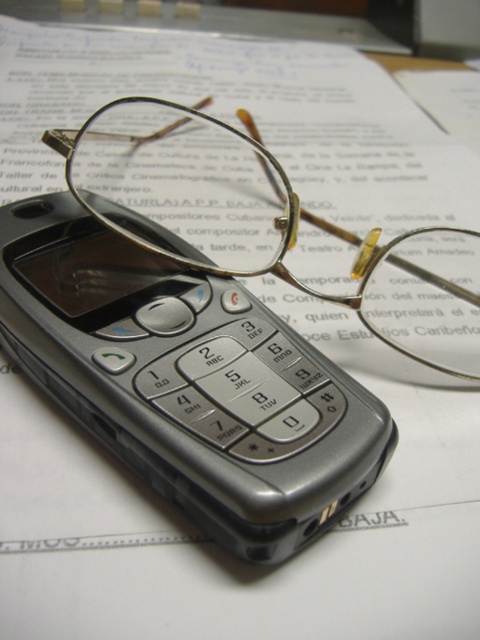
Is silver metallic phone at center closer to the viewer compared to gold metallic glasses at center?

Yes, it is.

Is silver metallic phone at center to the right of gold metallic glasses at center from the viewer's perspective?

In fact, silver metallic phone at center is to the left of gold metallic glasses at center.

Where is `silver metallic phone at center`? silver metallic phone at center is located at coordinates (187, 380).

This screenshot has height=640, width=480. What are the coordinates of `silver metallic phone at center` in the screenshot? It's located at (187, 380).